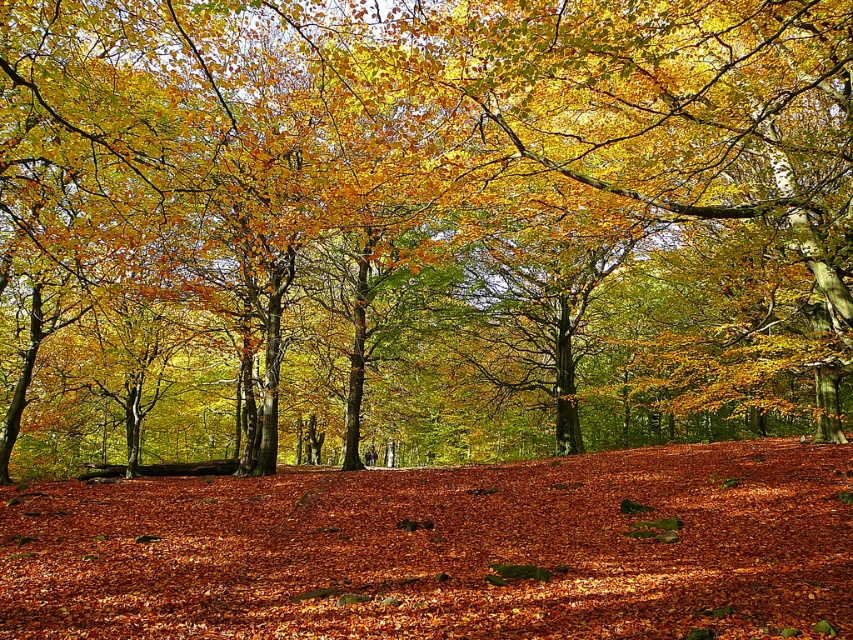
Does golden glossy leaves at center appear under brown leaf litter at center?

No.

Who is more distant from viewer, [73,337] or [511,636]?

The point [73,337] is behind.

Identify the location of golden glossy leaves at center. The width and height of the screenshot is (853, 640). (419, 227).